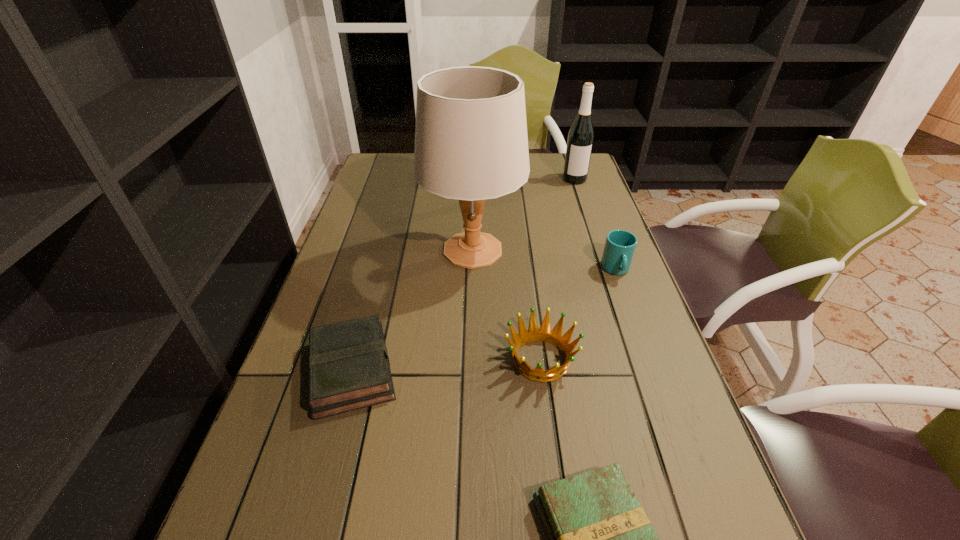
The width and height of the screenshot is (960, 540). Identify the location of free space that is in between the farthest object and the cup. (595, 225).

The image size is (960, 540). Identify the location of unoccupied position between the table lamp and the crown. (507, 305).

Locate an element on the screen. The width and height of the screenshot is (960, 540). unoccupied position between the fourth tallest object and the leftmost object is located at coordinates (446, 364).

Image resolution: width=960 pixels, height=540 pixels. I want to click on vacant area between the fifth shortest object and the cup, so click(595, 225).

Identify the location of vacant space that's between the tallest object and the third tallest object. Image resolution: width=960 pixels, height=540 pixels. (544, 260).

Where is `vacant area that lies between the crown and the third tallest object`? The width and height of the screenshot is (960, 540). vacant area that lies between the crown and the third tallest object is located at coordinates (579, 314).

Locate an element on the screen. The height and width of the screenshot is (540, 960). vacant space in between the farther book and the farthest object is located at coordinates (463, 275).

Locate which object ranks third in proximity to the second tallest object. Please provide its 2D coordinates. Your answer should be formatted as a tuple, i.e. [(x, y)], where the tuple contains the x and y coordinates of a point satisfying the conditions above.

[(544, 334)]

Locate which object is the third closest to the table lamp. Please provide its 2D coordinates. Your answer should be formatted as a tuple, i.e. [(x, y)], where the tuple contains the x and y coordinates of a point satisfying the conditions above.

[(620, 245)]

This screenshot has width=960, height=540. Find the location of `free space that satisfies the following two spatial constraints: 1. on the back side of the fourth tallest object; 2. on the right side of the farther book`. free space that satisfies the following two spatial constraints: 1. on the back side of the fourth tallest object; 2. on the right side of the farther book is located at coordinates (354, 359).